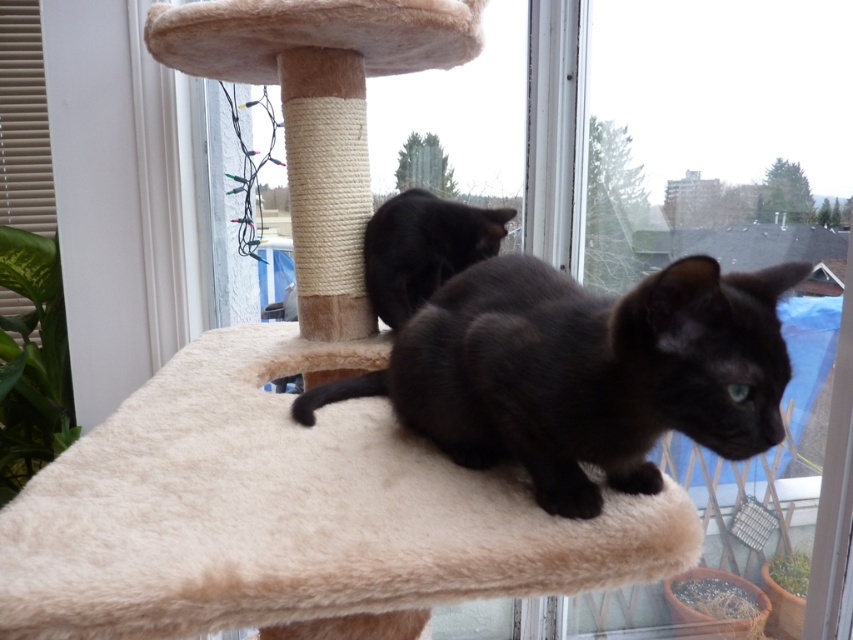
Question: Is beige plush cat bed at center smaller than black matte cat at center?

Choices:
 (A) no
 (B) yes

Answer: (A)

Question: Does shiny black cat at center have a smaller size compared to black matte cat at center?

Choices:
 (A) no
 (B) yes

Answer: (A)

Question: Based on their relative distances, which object is nearer to the black matte cat at center?

Choices:
 (A) beige plush cat bed at center
 (B) shiny black cat at center

Answer: (A)

Question: Estimate the real-world distances between objects in this image. Which object is closer to the shiny black cat at center?

Choices:
 (A) beige plush cat bed at center
 (B) black matte cat at center

Answer: (A)

Question: Can you confirm if beige plush cat bed at center is positioned above black matte cat at center?

Choices:
 (A) yes
 (B) no

Answer: (B)

Question: Which of the following is the farthest from the observer?

Choices:
 (A) (61, 509)
 (B) (764, 385)

Answer: (A)